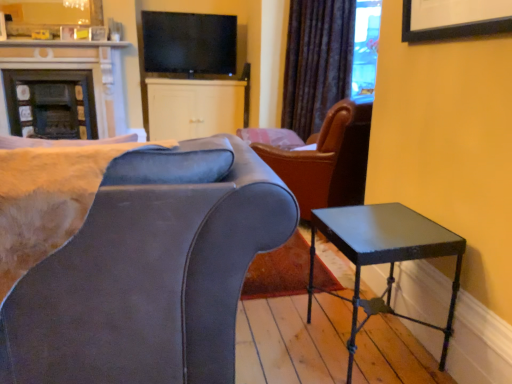
Question: Is metallic black side table at lower right to the left of white matte cabinet at center from the viewer's perspective?

Choices:
 (A) no
 (B) yes

Answer: (A)

Question: From a real-world perspective, is metallic black side table at lower right on white matte cabinet at center?

Choices:
 (A) no
 (B) yes

Answer: (A)

Question: Would you say white matte cabinet at center is part of metallic black side table at lower right's contents?

Choices:
 (A) no
 (B) yes

Answer: (A)

Question: Is there a large distance between metallic black side table at lower right and white matte cabinet at center?

Choices:
 (A) no
 (B) yes

Answer: (B)

Question: From a real-world perspective, does metallic black side table at lower right sit lower than white matte cabinet at center?

Choices:
 (A) no
 (B) yes

Answer: (B)

Question: In terms of height, does matte black fireplace at upper left look taller or shorter compared to matte black tv at upper center?

Choices:
 (A) short
 (B) tall

Answer: (B)

Question: From a real-world perspective, is matte black fireplace at upper left physically located above or below matte black tv at upper center?

Choices:
 (A) above
 (B) below

Answer: (B)

Question: Based on their sizes in the image, would you say matte black fireplace at upper left is bigger or smaller than matte black tv at upper center?

Choices:
 (A) big
 (B) small

Answer: (A)

Question: Considering the positions of matte black fireplace at upper left and matte black tv at upper center in the image, is matte black fireplace at upper left wider or thinner than matte black tv at upper center?

Choices:
 (A) wide
 (B) thin

Answer: (A)

Question: Would you say velvet dark brown curtain at upper center is inside or outside metallic black side table at lower right?

Choices:
 (A) outside
 (B) inside

Answer: (A)

Question: In terms of height, does velvet dark brown curtain at upper center look taller or shorter compared to metallic black side table at lower right?

Choices:
 (A) tall
 (B) short

Answer: (A)

Question: From the image's perspective, is velvet dark brown curtain at upper center located above or below metallic black side table at lower right?

Choices:
 (A) below
 (B) above

Answer: (B)

Question: Is point (343, 59) positioned closer to the camera than point (425, 223)?

Choices:
 (A) closer
 (B) farther

Answer: (B)

Question: From a real-world perspective, is matte black tv at upper center above or below velvet dark brown curtain at upper center?

Choices:
 (A) above
 (B) below

Answer: (A)

Question: Would you say matte black tv at upper center is inside or outside velvet dark brown curtain at upper center?

Choices:
 (A) outside
 (B) inside

Answer: (A)